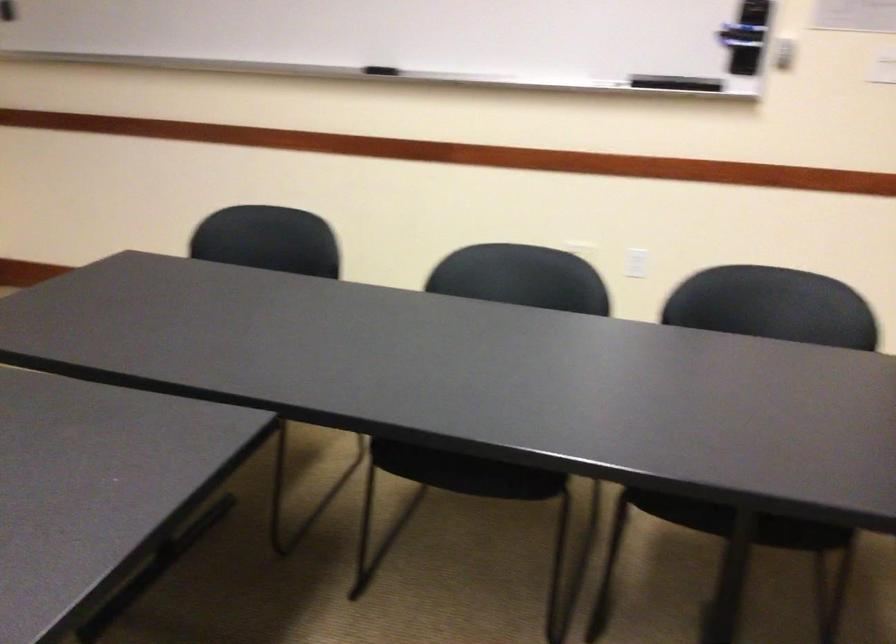
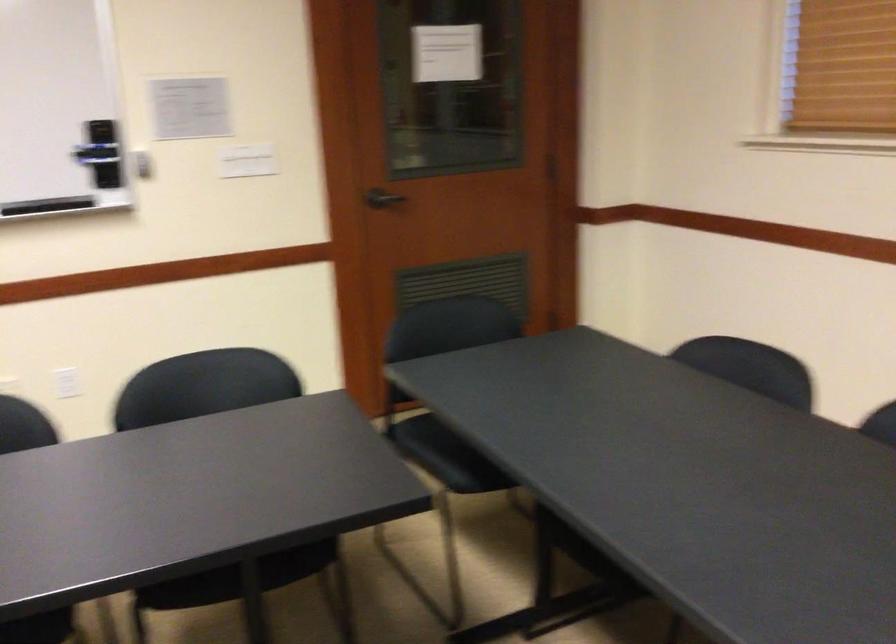
Question: The images are taken continuously from a first-person perspective. In which direction is your viewpoint rotating?

Choices:
 (A) Left
 (B) Right
 (C) Up
 (D) Down

Answer: (B)